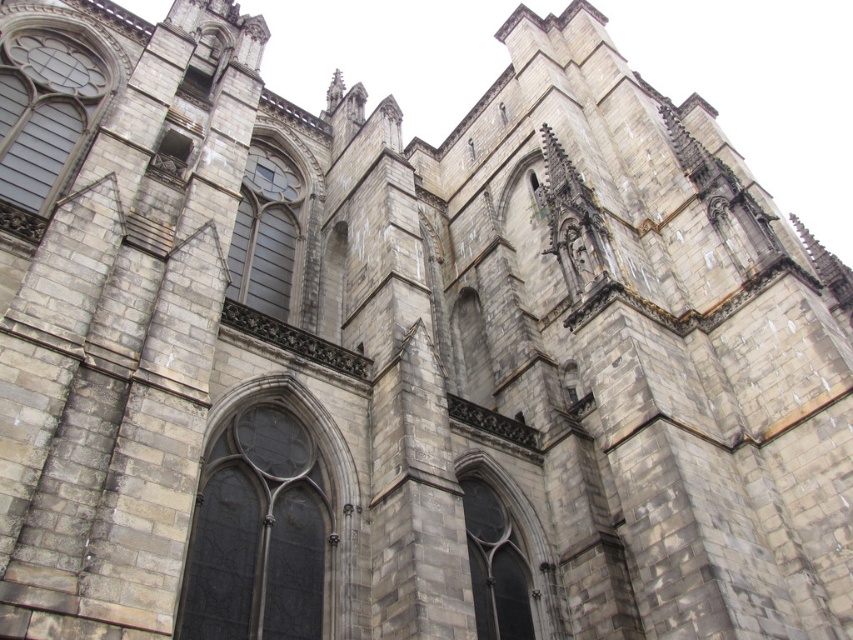
Is dark glass window at center smaller than dark gray stone window at center?

No, dark glass window at center is not smaller than dark gray stone window at center.

Who is more forward, (296, 564) or (492, 621)?

Point (296, 564) is in front.

Image resolution: width=853 pixels, height=640 pixels. Find the location of `dark glass window at center`. dark glass window at center is located at coordinates (258, 532).

You are a GUI agent. You are given a task and a screenshot of the screen. Output one action in this format:
    pyautogui.click(x=<x>, y=<y>)
    Task: Click on the dark glass window at center
    The width and height of the screenshot is (853, 640).
    Given the screenshot: What is the action you would take?
    pyautogui.click(x=258, y=532)

Can you confirm if dark glass window at center is positioned below dark gray stone window at upper left?

Indeed, dark glass window at center is positioned under dark gray stone window at upper left.

Find the location of a particular element. This screenshot has width=853, height=640. dark glass window at center is located at coordinates (258, 532).

Does dark glass window at center have a smaller size compared to gray stone window at center?

Indeed, dark glass window at center has a smaller size compared to gray stone window at center.

Is dark glass window at center above gray stone window at center?

Actually, dark glass window at center is below gray stone window at center.

At what (x,y) coordinates should I click in order to perform the action: click on dark glass window at center. Please return your answer as a coordinate pair (x, y). The image size is (853, 640). Looking at the image, I should click on (258, 532).

Identify the location of dark glass window at center. This screenshot has height=640, width=853. (258, 532).